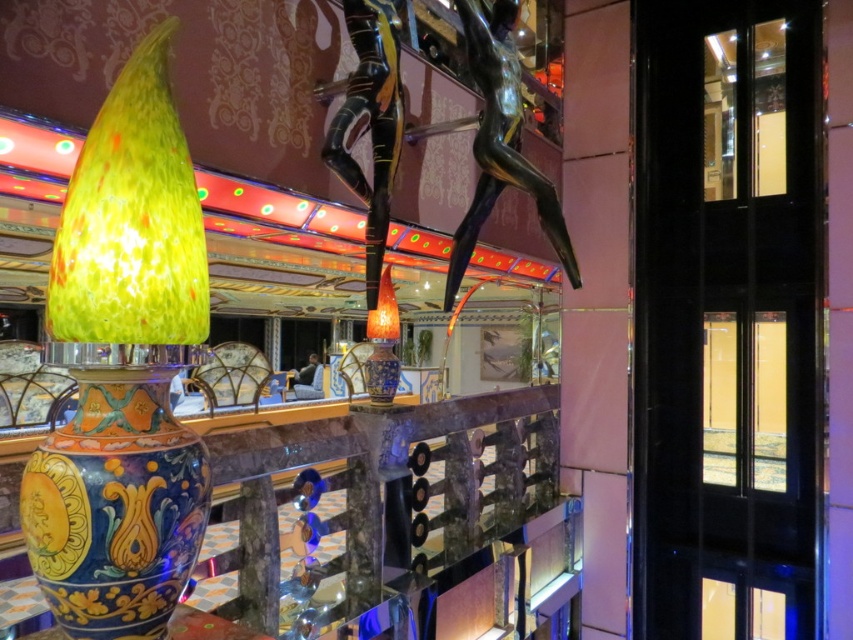
Which is more to the left, black glossy statue at center or shiny blue glass vase at center?

black glossy statue at center

Between black glossy statue at center and shiny blue glass vase at center, which one appears on the right side from the viewer's perspective?

shiny blue glass vase at center

Which is in front, point (378, 278) or point (380, 368)?

Point (378, 278) is more forward.

This screenshot has width=853, height=640. In order to click on black glossy statue at center in this screenshot , I will do `click(370, 122)`.

Does multicolored ceramic vase at left appear on the right side of black glossy statue at center?

No, multicolored ceramic vase at left is not to the right of black glossy statue at center.

Who is more forward, [137,129] or [369,282]?

Point [137,129] is in front.

Which is in front, point (78, 545) or point (349, 140)?

Point (78, 545) is more forward.

Where is `multicolored ceramic vase at left`? multicolored ceramic vase at left is located at coordinates click(x=123, y=369).

Between hand-painted ceramic vase at center and shiny blue glass vase at center, which one is positioned lower?

hand-painted ceramic vase at center is below.

Who is more distant from viewer, (36, 547) or (393, 332)?

Positioned behind is point (393, 332).

Locate an element on the screen. hand-painted ceramic vase at center is located at coordinates (115, 508).